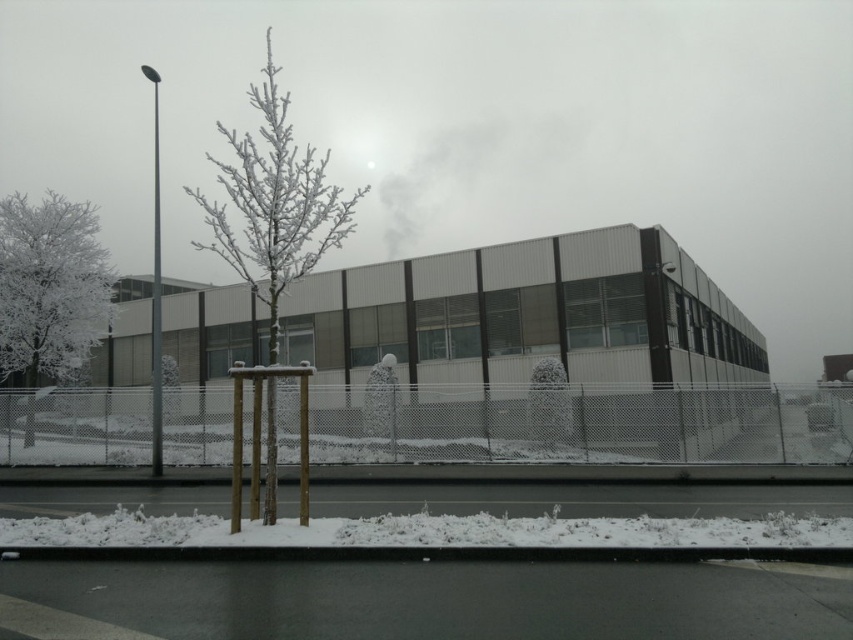
Question: Which object is closer to the camera taking this photo?

Choices:
 (A) frosted white tree at center
 (B) wire mesh fence at lower center
 (C) white fluffy snow at lower center
 (D) white frosted tree at left

Answer: (C)

Question: Among these objects, which one is nearest to the camera?

Choices:
 (A) white fluffy snow at lower center
 (B) frosted white tree at center
 (C) wire mesh fence at lower center
 (D) white frosted tree at left

Answer: (A)

Question: Which object is closer to the camera taking this photo?

Choices:
 (A) white frosted tree at left
 (B) wire mesh fence at lower center
 (C) white fluffy snow at lower center

Answer: (C)

Question: Is white fluffy snow at lower center smaller than white frosted tree at left?

Choices:
 (A) no
 (B) yes

Answer: (B)

Question: Can you confirm if white fluffy snow at lower center is positioned to the left of white frosted tree at left?

Choices:
 (A) yes
 (B) no

Answer: (B)

Question: Can you confirm if white fluffy snow at lower center is thinner than white frosted tree at left?

Choices:
 (A) no
 (B) yes

Answer: (B)